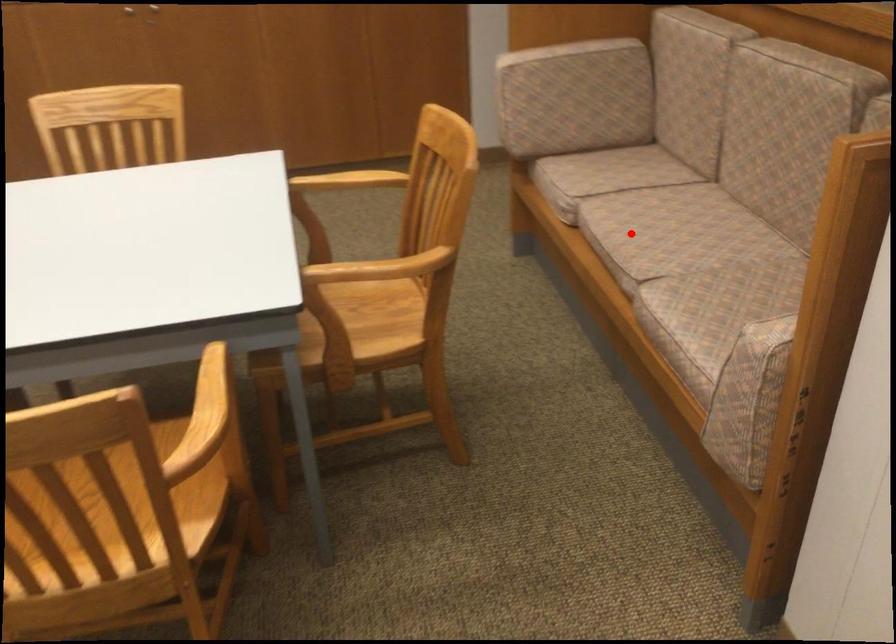
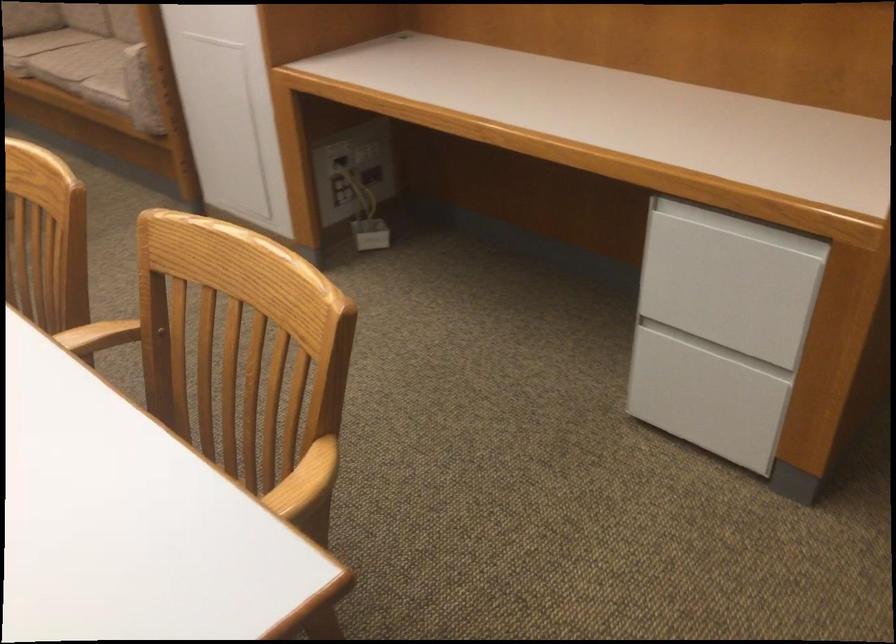
Question: I am providing you with two images of the same scene from different viewpoints. Given a red point in image1, look at the same physical point in image2. Is it:

Choices:
 (A) Closer to the viewpoint
 (B) Farther from the viewpoint

Answer: (B)